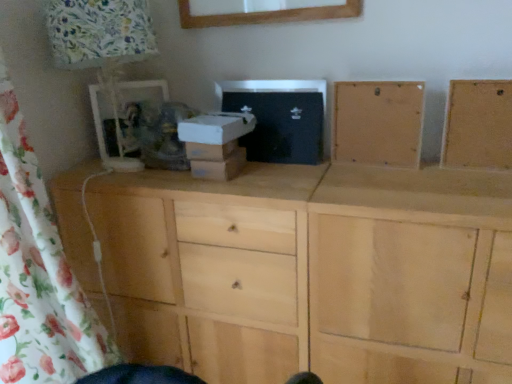
Find the location of a particular element. free space in front of natural wood frame at upper right, positioned as the second cabinetry in left-to-right order is located at coordinates (490, 182).